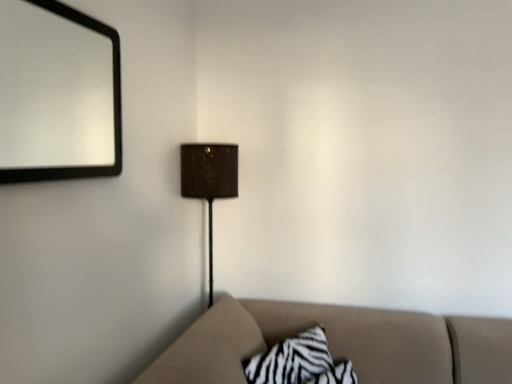
Question: Visually, is zebra-patterned fabric pillow at lower center positioned to the left or to the right of black matte mirror at upper left?

Choices:
 (A) left
 (B) right

Answer: (B)

Question: Looking at the image, does zebra-patterned fabric pillow at lower center seem bigger or smaller compared to black matte mirror at upper left?

Choices:
 (A) big
 (B) small

Answer: (A)

Question: Which is nearer to the matte brown lampshade at center?

Choices:
 (A) zebra-patterned fabric pillow at lower center
 (B) black matte mirror at upper left

Answer: (A)

Question: Which of these objects is positioned farthest from the matte brown lampshade at center?

Choices:
 (A) black matte mirror at upper left
 (B) zebra-patterned fabric pillow at lower center

Answer: (A)